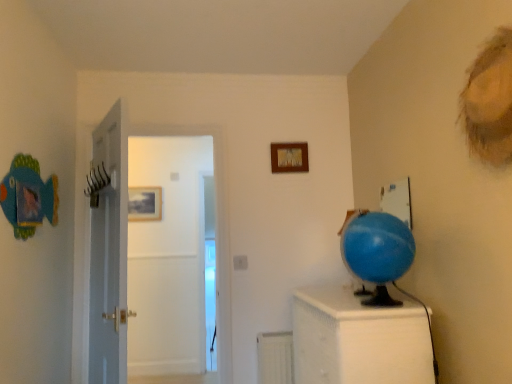
This screenshot has height=384, width=512. What do you see at coordinates (359, 339) in the screenshot?
I see `white textured cabinet at right` at bounding box center [359, 339].

In order to face white matte radiator at lower center, should I rotate leftwards or rightwards?

To align with it, rotate right about 2.730°.

This screenshot has width=512, height=384. In order to click on wooden picture frame at upper center, acting as the second picture frame starting from the back in this screenshot , I will do `click(289, 157)`.

Locate an element on the screen. white glossy door at center is located at coordinates (168, 257).

Which is more to the right, matte wooden picture frame at center, which appears as the second picture frame when viewed from the right, or white matte radiator at lower center?

white matte radiator at lower center.

The image size is (512, 384). Identify the location of the 1st picture frame above the white matte radiator at lower center (from the image's perspective). (145, 203).

Would you say matte wooden picture frame at center, which appears as the first picture frame when viewed from the back, is inside or outside white matte radiator at lower center?

matte wooden picture frame at center, which appears as the first picture frame when viewed from the back, is not enclosed by white matte radiator at lower center.

Considering the sizes of white textured cabinet at right and white matte radiator at lower center in the image, is white textured cabinet at right wider or thinner than white matte radiator at lower center?

white textured cabinet at right is wider than white matte radiator at lower center.

Do you think white textured cabinet at right is within white matte radiator at lower center, or outside of it?

The correct answer is: outside.

From a real-world perspective, which is physically above, white textured cabinet at right or white matte radiator at lower center?

white textured cabinet at right is physically above.

Between point (340, 344) and point (277, 370), which one is positioned behind?

The point (277, 370) is more distant.

Is white textured cabinet at right positioned with its back to wooden picture frame at upper center, which appears as the 2th picture frame when ordered from the bottom?

No, white textured cabinet at right is not facing the opposite direction of wooden picture frame at upper center, which appears as the 2th picture frame when ordered from the bottom.

In terms of width, does white textured cabinet at right look wider or thinner when compared to wooden picture frame at upper center, the 2th picture frame in the left-to-right sequence?

Clearly, white textured cabinet at right has more width compared to wooden picture frame at upper center, the 2th picture frame in the left-to-right sequence.

From the image's perspective, is white textured cabinet at right positioned above or below wooden picture frame at upper center, the 1th picture frame viewed from the top?

white textured cabinet at right is situated lower than wooden picture frame at upper center, the 1th picture frame viewed from the top, in the image.

In the image, is white textured cabinet at right positioned in front of or behind wooden picture frame at upper center, acting as the second picture frame starting from the back?

Clearly, white textured cabinet at right is in front of wooden picture frame at upper center, acting as the second picture frame starting from the back.

Which of these two, blue rubber globe at right or white matte radiator at lower center, stands taller?

With more height is blue rubber globe at right.

Considering the positions of point (394, 257) and point (258, 377), is point (394, 257) closer or farther from the camera than point (258, 377)?

Point (394, 257).

Based on the photo, which of these two, blue rubber globe at right or white matte radiator at lower center, is thinner?

white matte radiator at lower center is thinner.

Looking at this image, looking at the image, does blue rubber globe at right seem bigger or smaller compared to white matte radiator at lower center?

Considering their sizes, blue rubber globe at right takes up more space than white matte radiator at lower center.

Which is in front, white matte radiator at lower center or white textured cabinet at right?

white textured cabinet at right is closer to the camera.

Considering the sizes of objects white matte radiator at lower center and white textured cabinet at right in the image provided, who is wider, white matte radiator at lower center or white textured cabinet at right?

Wider between the two is white textured cabinet at right.

Is white matte radiator at lower center positioned with its back to white textured cabinet at right?

No.

Considering the relative sizes of white matte radiator at lower center and white textured cabinet at right in the image provided, is white matte radiator at lower center bigger than white textured cabinet at right?

No, white matte radiator at lower center is not bigger than white textured cabinet at right.

Is the surface of wooden picture frame at upper center, which appears as the first picture frame when viewed from the right, in direct contact with blue rubber globe at right?

They are not placed beside each other.

Based on the photo, is wooden picture frame at upper center, the 2th picture frame in the left-to-right sequence, located outside blue rubber globe at right?

wooden picture frame at upper center, the 2th picture frame in the left-to-right sequence, lies outside blue rubber globe at right's area.

From the image's perspective, is wooden picture frame at upper center, acting as the second picture frame starting from the back, on blue rubber globe at right?

Yes, from the image's perspective, wooden picture frame at upper center, acting as the second picture frame starting from the back, is above blue rubber globe at right.

Is wooden picture frame at upper center, which ranks as the first picture frame in front-to-back order, thinner than blue rubber globe at right?

Correct, the width of wooden picture frame at upper center, which ranks as the first picture frame in front-to-back order, is less than that of blue rubber globe at right.

From a real-world perspective, which object stands above the other?

From a 3D spatial view, white glossy door at center is above.

How different are the orientations of white glossy door at center and white matte radiator at lower center in degrees?

white glossy door at center and white matte radiator at lower center are facing 0.0302 degrees away from each other.

Who is smaller, white glossy door at center or white matte radiator at lower center?

With smaller size is white matte radiator at lower center.

Does white glossy door at center contain white matte radiator at lower center?

No, white glossy door at center does not contain white matte radiator at lower center.

Find the location of a particular element. radiator below the matte wooden picture frame at center, the first picture frame positioned from the left (from the image's perspective) is located at coordinates (275, 358).

This screenshot has height=384, width=512. What are the coordinates of `radiator on the left of the white textured cabinet at right` in the screenshot? It's located at (275, 358).

When comparing their distances from matte wooden picture frame at center, which is counted as the 1th picture frame, starting from the bottom, does white matte radiator at lower center or wooden picture frame at upper center, which appears as the 2th picture frame when ordered from the bottom, seem closer?

Based on the image, wooden picture frame at upper center, which appears as the 2th picture frame when ordered from the bottom, appears to be nearer to matte wooden picture frame at center, which is counted as the 1th picture frame, starting from the bottom.

Considering their positions, is blue rubber globe at right positioned further to white glossy door at center than white textured cabinet at right?

Among the two, blue rubber globe at right is located further to white glossy door at center.

Considering their positions, is wooden picture frame at upper center, which appears as the first picture frame when viewed from the right, positioned further to blue rubber globe at right than white textured cabinet at right?

wooden picture frame at upper center, which appears as the first picture frame when viewed from the right, is positioned further to the anchor blue rubber globe at right.

From the image, which object appears to be farther from white matte radiator at lower center, white glossy door at center or matte wooden picture frame at center, which is counted as the 1th picture frame, starting from the bottom?

Among the two, matte wooden picture frame at center, which is counted as the 1th picture frame, starting from the bottom, is located further to white matte radiator at lower center.

Based on their spatial positions, is matte wooden picture frame at center, which is counted as the 1th picture frame, starting from the bottom, or blue rubber globe at right further from white matte radiator at lower center?

Based on the image, matte wooden picture frame at center, which is counted as the 1th picture frame, starting from the bottom, appears to be further to white matte radiator at lower center.

Which object lies further to the anchor point white glossy door at center, white textured cabinet at right or wooden picture frame at upper center, acting as the second picture frame starting from the back?

white textured cabinet at right.

Which object lies further to the anchor point white glossy door at center, white matte radiator at lower center or blue rubber globe at right?

blue rubber globe at right is positioned further to the anchor white glossy door at center.

Considering their positions, is white textured cabinet at right positioned closer to white matte radiator at lower center than matte wooden picture frame at center, marked as the second picture frame in a front-to-back arrangement?

white textured cabinet at right is closer to white matte radiator at lower center.

Identify the location of door positioned between blue rubber globe at right and matte wooden picture frame at center, the first picture frame positioned from the left, from near to far. (168, 257).

Locate an element on the screen. Image resolution: width=512 pixels, height=384 pixels. balloon between wooden picture frame at upper center, the 1th picture frame viewed from the top, and white matte radiator at lower center, in the vertical direction is located at coordinates (377, 247).

Image resolution: width=512 pixels, height=384 pixels. Identify the location of picture frame between white matte radiator at lower center and matte wooden picture frame at center, which appears as the second picture frame when viewed from the right, in the front-back direction. (289, 157).

Locate an element on the screen. This screenshot has width=512, height=384. balloon located between white textured cabinet at right and wooden picture frame at upper center, which appears as the first picture frame when viewed from the right, in the depth direction is located at coordinates (377, 247).